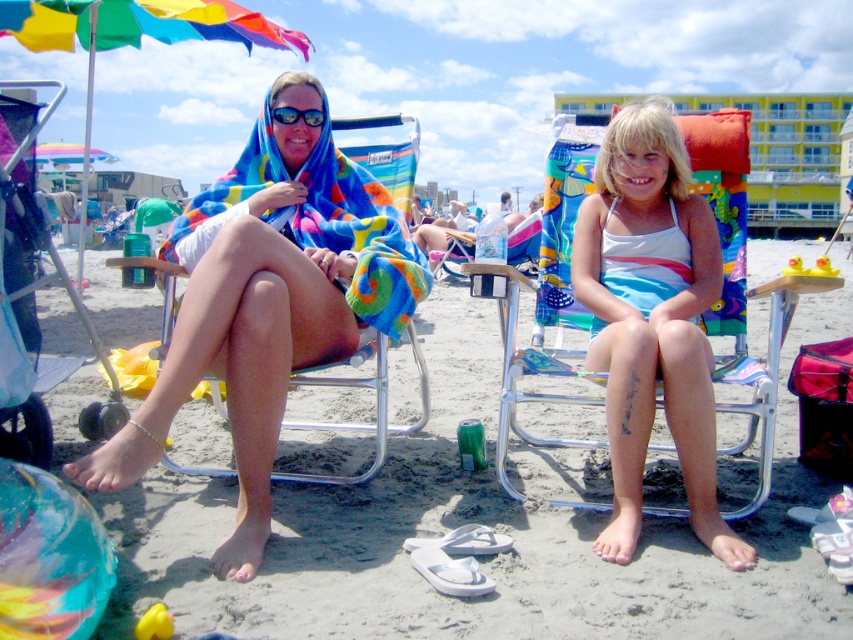
Is multicolored towel at center positioned before white satin dress at center?

Yes, multicolored towel at center is in front of white satin dress at center.

Is point (306, 220) behind point (683, 296)?

Yes, point (306, 220) is farther from viewer.

Is point (364, 192) less distant than point (666, 392)?

No, it is not.

Find the location of a particular element. This screenshot has width=853, height=640. multicolored towel at center is located at coordinates (270, 301).

Does metallic silver beach chair at left appear over matte black goggles at center?

No, metallic silver beach chair at left is not above matte black goggles at center.

Who is higher up, metallic silver beach chair at left or matte black goggles at center?

matte black goggles at center

What do you see at coordinates (27, 285) in the screenshot? This screenshot has width=853, height=640. I see `metallic silver beach chair at left` at bounding box center [27, 285].

Where is `metallic silver beach chair at left`? metallic silver beach chair at left is located at coordinates (27, 285).

Looking at this image, does multicolored towel at left appear on the left side of matte black goggles at center?

Incorrect, multicolored towel at left is not on the left side of matte black goggles at center.

Between multicolored towel at left and matte black goggles at center, which one has less height?

matte black goggles at center is shorter.

Between point (250, 170) and point (277, 113), which one is positioned in front?

Positioned in front is point (277, 113).

Where is `multicolored towel at left`? multicolored towel at left is located at coordinates (361, 234).